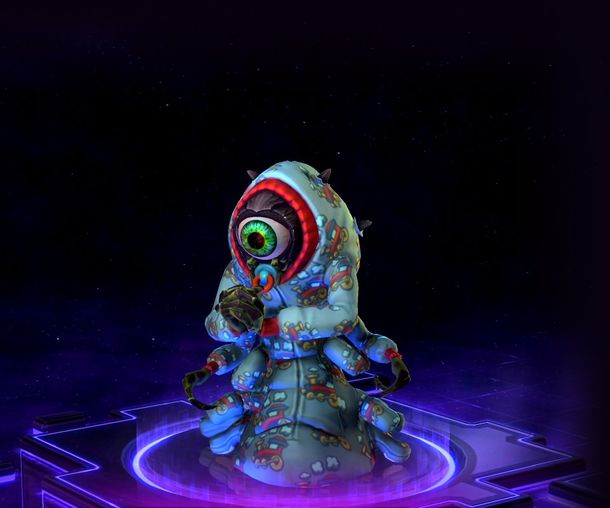
The image size is (610, 508). I want to click on surface, so click(500, 449).